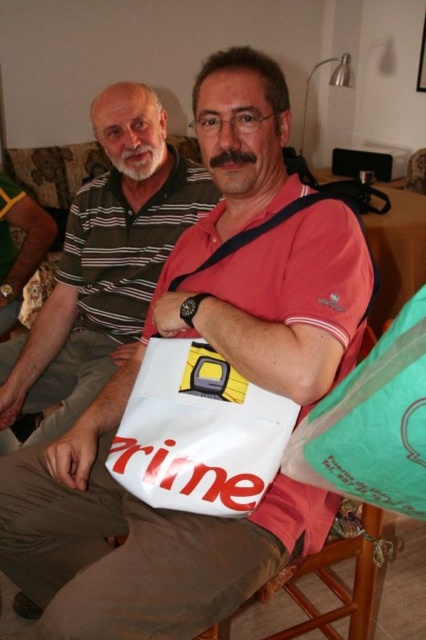
Does white matte bag at center appear under green plastic bag at lower right?

Incorrect, white matte bag at center is not positioned below green plastic bag at lower right.

Consider the image. Does white matte bag at center have a larger size compared to green plastic bag at lower right?

Yes, white matte bag at center is bigger than green plastic bag at lower right.

Image resolution: width=426 pixels, height=640 pixels. I want to click on white matte bag at center, so click(104, 262).

Find the location of a particular element. white matte tote at center is located at coordinates (198, 433).

I want to click on white matte tote at center, so point(198,433).

Where is `white matte tote at center`? Image resolution: width=426 pixels, height=640 pixels. white matte tote at center is located at coordinates (198, 433).

Can you confirm if white matte tote at center is thinner than wooden chair at lower center?

Yes.

Is point (219, 428) in front of point (374, 541)?

Yes, point (219, 428) is in front of point (374, 541).

Where is `white matte tote at center`? white matte tote at center is located at coordinates (198, 433).